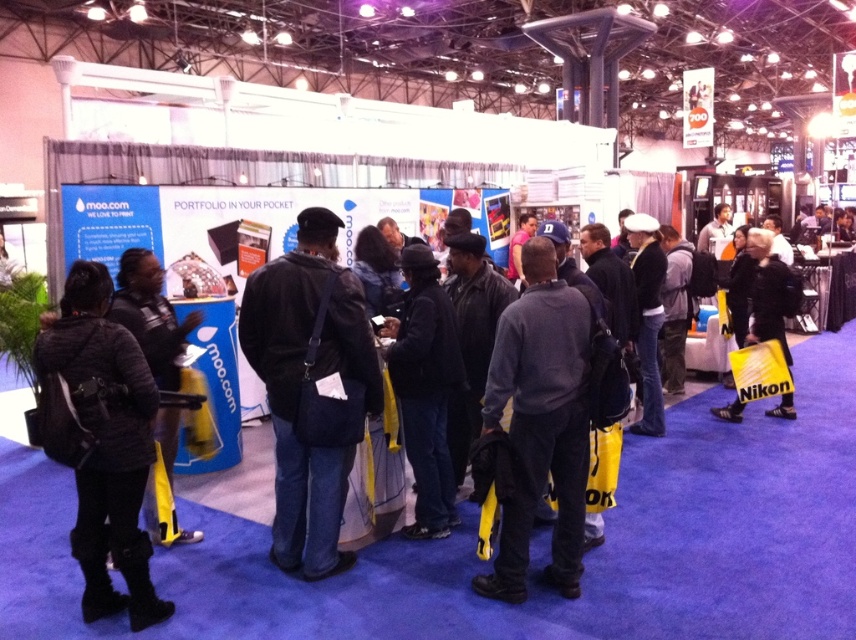
You are an event organizer who needs to hang a sign above the black quilted jacket at left and the black leather jacket at right. Which jacket requires a higher hanging hook due to its height?

The black leather jacket at right requires a higher hanging hook because it is taller than the black quilted jacket at left.